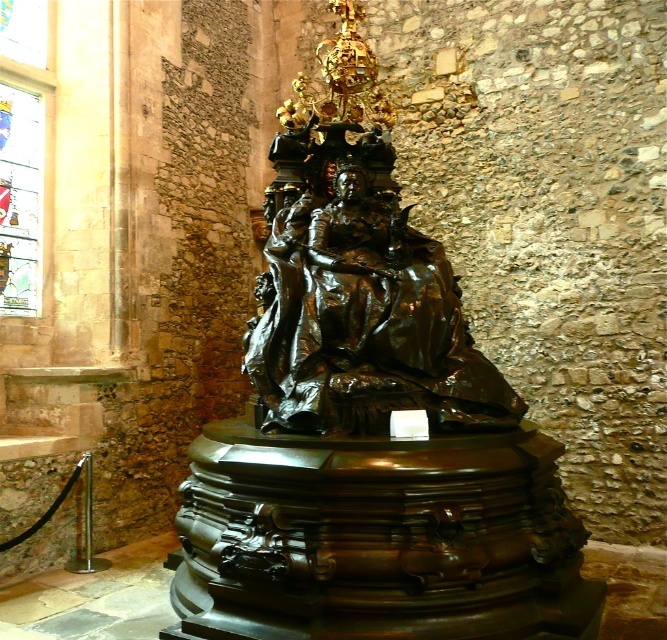
You are an art conservator assessing the placement of the bronze statue at center and the stained glass window at upper left. Based on their positions, which object is closer to the entrance of the cathedral if the entrance is located on the left side of the cathedral?

The stained glass window at upper left is closer to the entrance because the bronze statue at center is positioned to the right of it, meaning the window is nearer to the left side where the entrance is located.

You are an interior designer planning to place a new 2.5 meter wide decorative screen in the room. The screen must be placed between the bronze statue at center and the stained glass window at upper left. Based on the current layout, can the screen fit without overlapping either object?

The bronze statue at center might be wider than stained glass window at upper left, so it is uncertain if the 2.5 meter wide screen can fit between them without overlapping. The exact dimensions of both objects are needed for an accurate assessment.